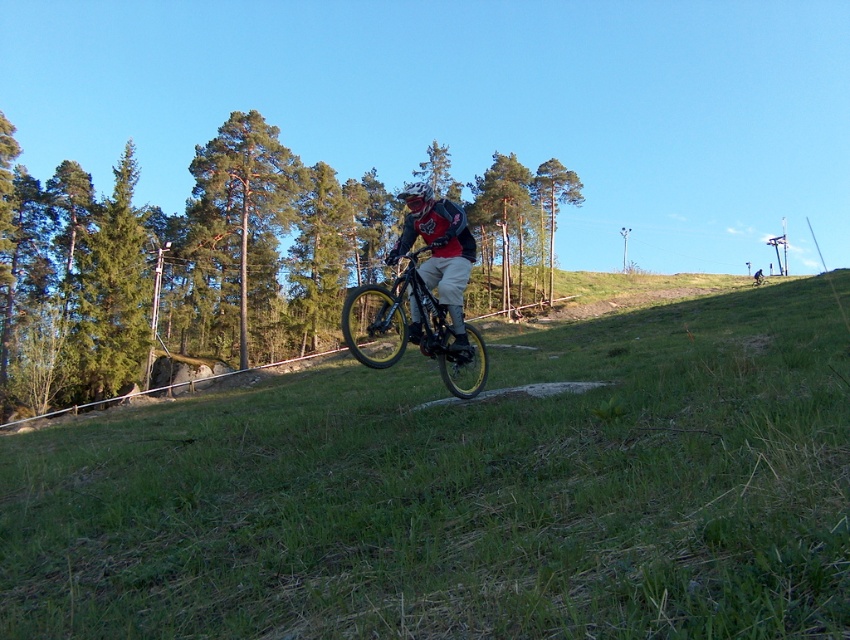
Question: Can you confirm if green grassy at center is positioned to the left of shiny metallic bicycle at center?

Choices:
 (A) yes
 (B) no

Answer: (B)

Question: Observing the image, what is the correct spatial positioning of shiny metallic bicycle at center in reference to matte black helmet at center?

Choices:
 (A) left
 (B) right

Answer: (A)

Question: Can you confirm if green grassy at center is wider than shiny metallic bicycle at center?

Choices:
 (A) yes
 (B) no

Answer: (A)

Question: Estimate the real-world distances between objects in this image. Which object is closer to the green grassy at center?

Choices:
 (A) shiny metallic bicycle at center
 (B) matte black helmet at center

Answer: (B)

Question: Which of the following is the farthest from the observer?

Choices:
 (A) shiny metallic bicycle at center
 (B) matte black helmet at center

Answer: (B)

Question: Which object appears closest to the camera in this image?

Choices:
 (A) shiny metallic bicycle at center
 (B) green grassy at center
 (C) matte black helmet at center

Answer: (B)